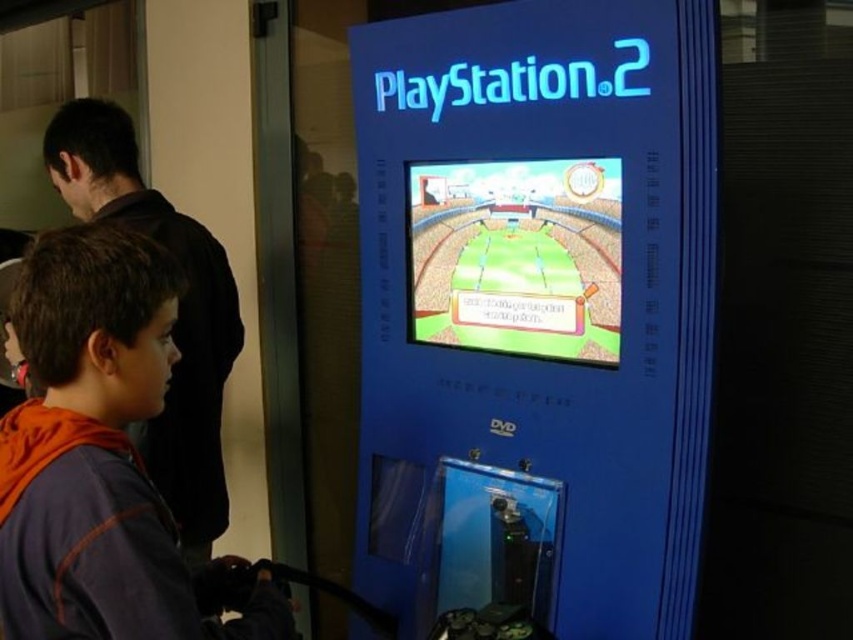
Can you confirm if blue plastic playstation 2 at center is shorter than dark brown hoodie at left?

No, blue plastic playstation 2 at center is not shorter than dark brown hoodie at left.

You are a GUI agent. You are given a task and a screenshot of the screen. Output one action in this format:
    pyautogui.click(x=<x>, y=<y>)
    Task: Click on the blue plastic playstation 2 at center
    This screenshot has width=853, height=640.
    Given the screenshot: What is the action you would take?
    pyautogui.click(x=541, y=289)

You are a GUI agent. You are given a task and a screenshot of the screen. Output one action in this format:
    pyautogui.click(x=<x>, y=<y>)
    Task: Click on the blue plastic playstation 2 at center
    
    Given the screenshot: What is the action you would take?
    pyautogui.click(x=541, y=289)

Can you confirm if blue plastic playstation 2 at center is positioned to the right of cartoonish plastic soccer field at center?

Incorrect, blue plastic playstation 2 at center is not on the right side of cartoonish plastic soccer field at center.

Which is more to the right, blue plastic playstation 2 at center or cartoonish plastic soccer field at center?

cartoonish plastic soccer field at center

Is point (567, 636) more distant than point (450, 209)?

No, it is not.

The image size is (853, 640). What are the coordinates of `blue plastic playstation 2 at center` in the screenshot? It's located at (541, 289).

Is orange fleece jacket at lower left bigger than cartoonish plastic soccer field at center?

Yes, orange fleece jacket at lower left is bigger than cartoonish plastic soccer field at center.

Who is taller, orange fleece jacket at lower left or cartoonish plastic soccer field at center?

With more height is orange fleece jacket at lower left.

What are the coordinates of `orange fleece jacket at lower left` in the screenshot? It's located at (97, 454).